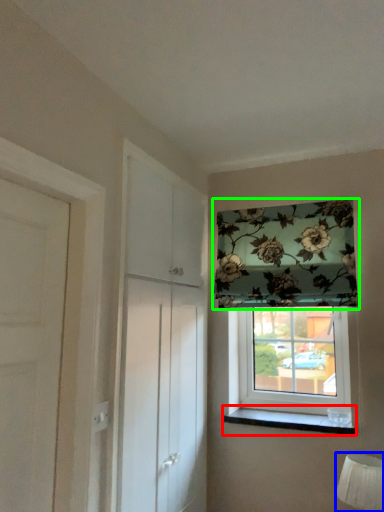
Question: Based on their relative distances, which object is nearer to window sill (highlighted by a red box)? Choose from table lamp (highlighted by a blue box) and window (highlighted by a green box).

Choices:
 (A) table lamp
 (B) window

Answer: (A)